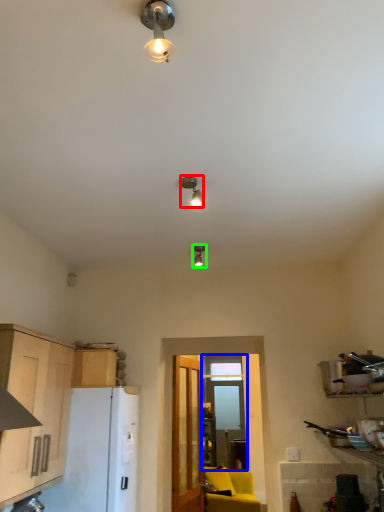
Question: Which is farther away from lamp (highlighted by a red box)? window (highlighted by a blue box) or lamp (highlighted by a green box)?

Choices:
 (A) window
 (B) lamp

Answer: (A)